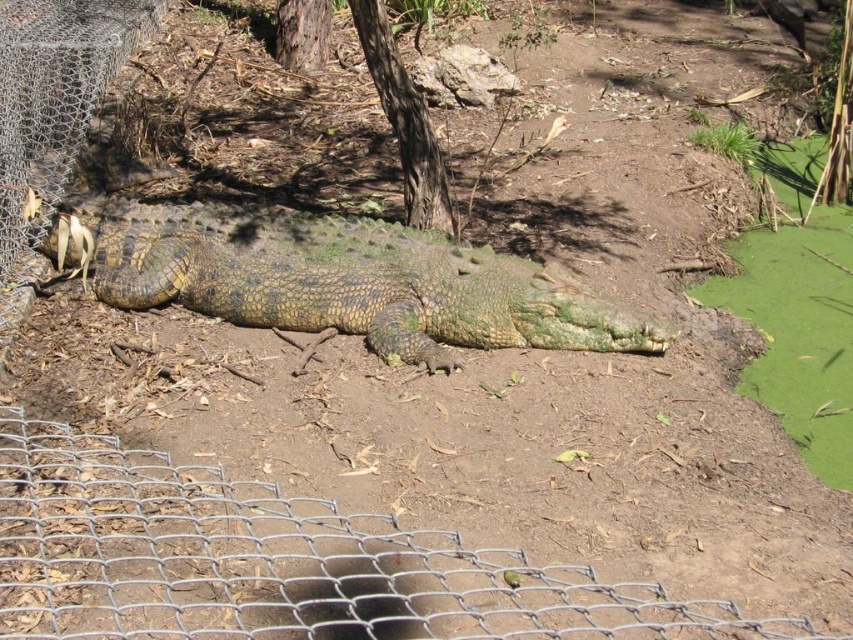
You are a park ranger assessing safety in the area. The wire mesh fence at lower left and the green scaly crocodile at center are in view. Based on their heights, can the crocodile potentially climb over the fence?

The wire mesh fence at lower left has a lesser height compared to green scaly crocodile at center, so the crocodile could potentially climb over the fence since it is taller than the fence.

You are a park ranger assessing safety in the area. You see a wire mesh fence at lower left and a green scaly crocodile at center. Can the crocodile potentially escape through the fence? Please explain based on their sizes.

The wire mesh fence at lower left is thinner than the green scaly crocodile at center. Since the fence is thinner, it is possible the crocodile cannot escape through it as the openings in the fence may be too small for the crocodile to pass through.